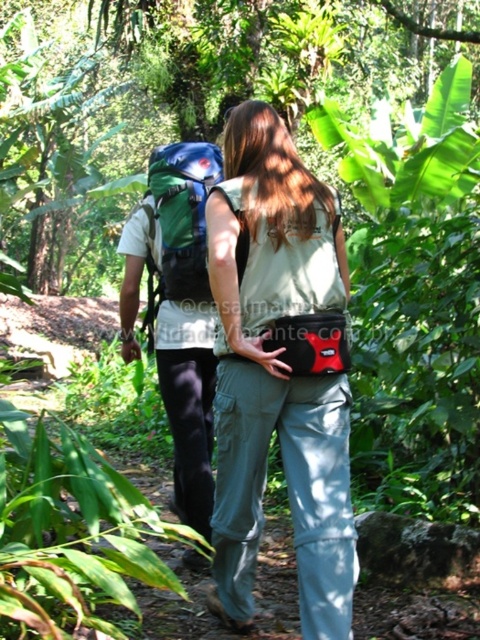
Does green fabric backpack at left have a greater height compared to green fabric backpack at center?

Yes, green fabric backpack at left is taller than green fabric backpack at center.

Between point (143, 221) and point (180, 232), which one is positioned behind?

The point (143, 221) is behind.

Where is `green fabric backpack at left`? Image resolution: width=480 pixels, height=640 pixels. green fabric backpack at left is located at coordinates (177, 310).

Is matte green backpack at center wider than green fabric backpack at center?

Correct, the width of matte green backpack at center exceeds that of green fabric backpack at center.

Is matte green backpack at center above green fabric backpack at center?

No.

The height and width of the screenshot is (640, 480). I want to click on matte green backpack at center, so pos(277,372).

Identify the location of matte green backpack at center. The image size is (480, 640). (277, 372).

How much distance is there between matte green backpack at center and green fabric backpack at left?

matte green backpack at center and green fabric backpack at left are 31.31 inches apart.

Consider the image. Who is lower down, matte green backpack at center or green fabric backpack at left?

matte green backpack at center

Describe the element at coordinates (277, 372) in the screenshot. This screenshot has width=480, height=640. I see `matte green backpack at center` at that location.

What are the coordinates of `matte green backpack at center` in the screenshot? It's located at (277, 372).